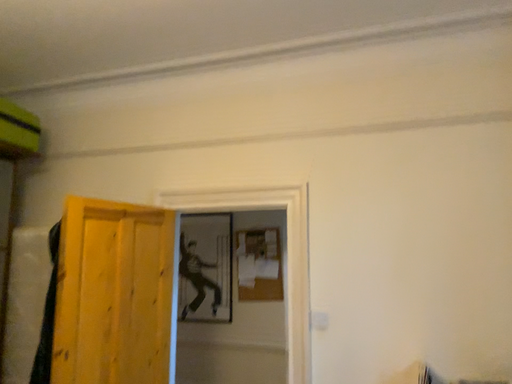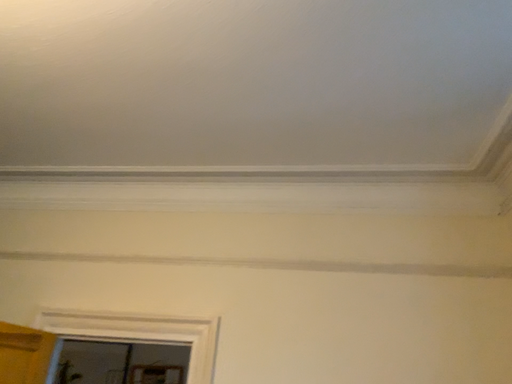
Question: Which way did the camera rotate in the video?

Choices:
 (A) rotated left
 (B) rotated right

Answer: (B)